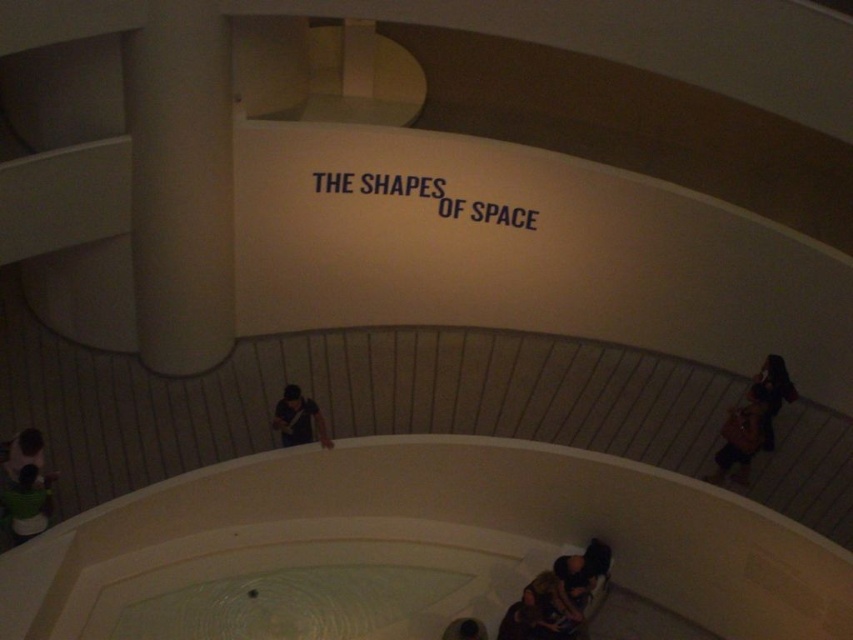
You are an artist preparing for an exhibition and need to place your brown leather bag at lower right and matte black shirt at center in this gallery. Given the size difference, which object will require more floor space?

The brown leather bag at lower right requires more floor space because it is bigger than the matte black shirt at center.

You are standing in the museum and need to place a small item in your bag. Where should you look to find your brown leather bag at lower right?

The brown leather bag at lower right is located at point (752, 420), which is in the lower right area of the scene. You should look towards the lower right direction to find it.